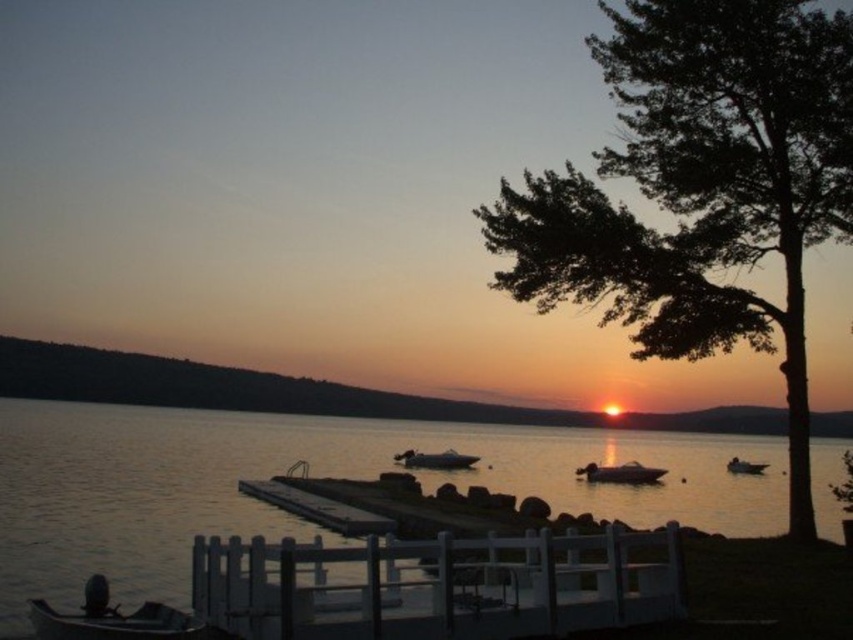
Is silhouette leafy tree at right positioned behind metallic gray boat at lower left?

Yes, it is behind metallic gray boat at lower left.

At what (x,y) coordinates should I click in order to perform the action: click on silhouette leafy tree at right. Please return your answer as a coordinate pair (x, y). This screenshot has width=853, height=640. Looking at the image, I should click on (700, 188).

Between silhouette leafy tree at right and white wooden dock at lower center, which one appears on the left side from the viewer's perspective?

white wooden dock at lower center

Image resolution: width=853 pixels, height=640 pixels. Describe the element at coordinates (700, 188) in the screenshot. I see `silhouette leafy tree at right` at that location.

You are a GUI agent. You are given a task and a screenshot of the screen. Output one action in this format:
    pyautogui.click(x=<x>, y=<y>)
    Task: Click on the silhouette leafy tree at right
    
    Given the screenshot: What is the action you would take?
    pyautogui.click(x=700, y=188)

Looking at this image, who is taller, glossy white boat at center or metallic silver boat at lower right?

Standing taller between the two is glossy white boat at center.

Locate an element on the screen. This screenshot has height=640, width=853. glossy white boat at center is located at coordinates (434, 460).

Between point (410, 464) and point (751, 467), which one is positioned in front?

Positioned in front is point (410, 464).

I want to click on glossy white boat at center, so click(x=434, y=460).